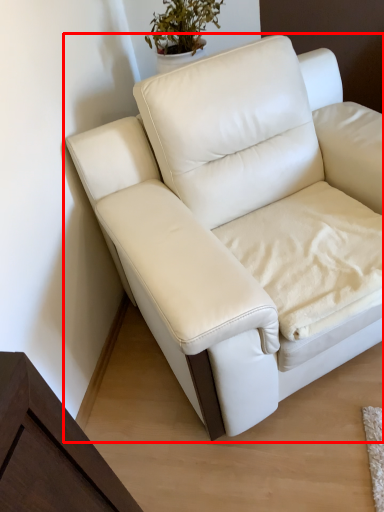
Question: From the image's perspective, what is the correct spatial relationship of studio couch (annotated by the red box) in relation to sheet?

Choices:
 (A) above
 (B) below

Answer: (A)